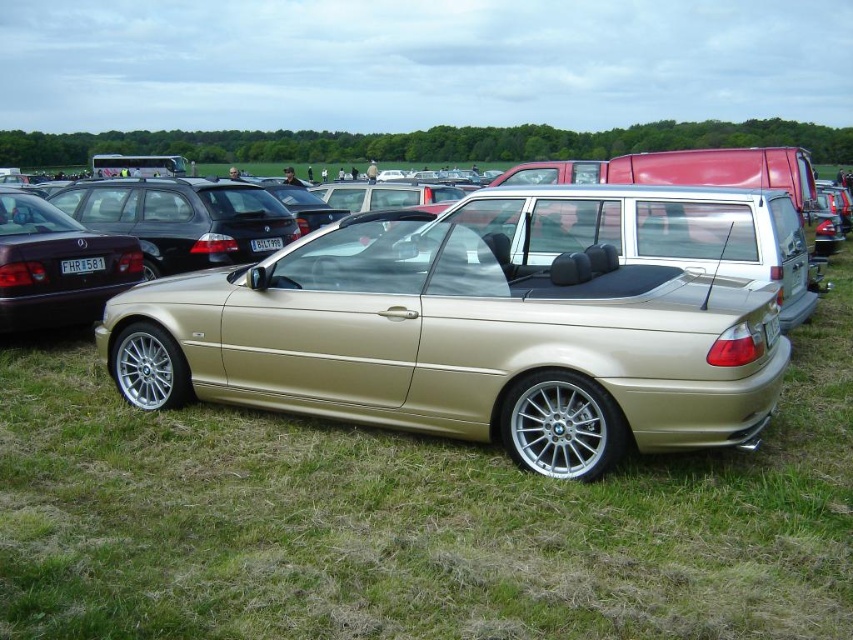
Question: Which object is farther from the camera taking this photo?

Choices:
 (A) white plastic license plate at center
 (B) gold metallic car at center

Answer: (A)

Question: Can you confirm if silver metallic rim at lower left is wider than black plastic license plate at center?

Choices:
 (A) yes
 (B) no

Answer: (A)

Question: Does gold metallic minivan at center come behind white plastic license plate at center?

Choices:
 (A) no
 (B) yes

Answer: (A)

Question: Is gold metallic minivan at center bigger than black plastic license plate at center?

Choices:
 (A) yes
 (B) no

Answer: (A)

Question: Which of the following is the farthest from the observer?

Choices:
 (A) (271, 240)
 (B) (18, 324)
 (C) (84, 260)

Answer: (A)

Question: Which object appears farthest from the camera in this image?

Choices:
 (A) silver metallic rim at lower left
 (B) silver metallic rim at lower center
 (C) white plastic license plate at center
 (D) gold metallic car at center

Answer: (C)